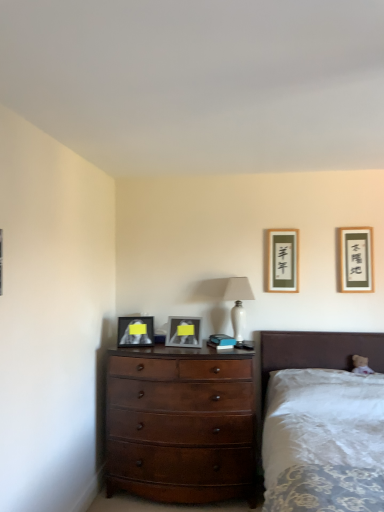
Question: Is mahogany wood dresser at center bigger or smaller than white glossy table lamp at center?

Choices:
 (A) small
 (B) big

Answer: (B)

Question: From a real-world perspective, is mahogany wood dresser at center above or below white glossy table lamp at center?

Choices:
 (A) above
 (B) below

Answer: (B)

Question: Which of these objects is positioned closest to the matte black picture frame at upper right, acting as the 2th picture frame starting from the right?

Choices:
 (A) mahogany wood dresser at center
 (B) matte black picture frame at upper right, marked as the 1th picture frame in a right-to-left arrangement
 (C) matte black picture frame at center, the fourth picture frame positioned from the right
 (D) white glossy table lamp at center
 (E) matte silver picture frame at center, acting as the 3th picture frame starting from the right

Answer: (D)

Question: Which is farther from the mahogany wood dresser at center?

Choices:
 (A) matte black picture frame at upper right, the third picture frame from the left
 (B) matte black picture frame at upper right, which is the fourth picture frame from left to right
 (C) matte silver picture frame at center, acting as the 3th picture frame starting from the right
 (D) white fabric bed at lower right
 (E) matte black picture frame at center, the first picture frame positioned from the left

Answer: (B)